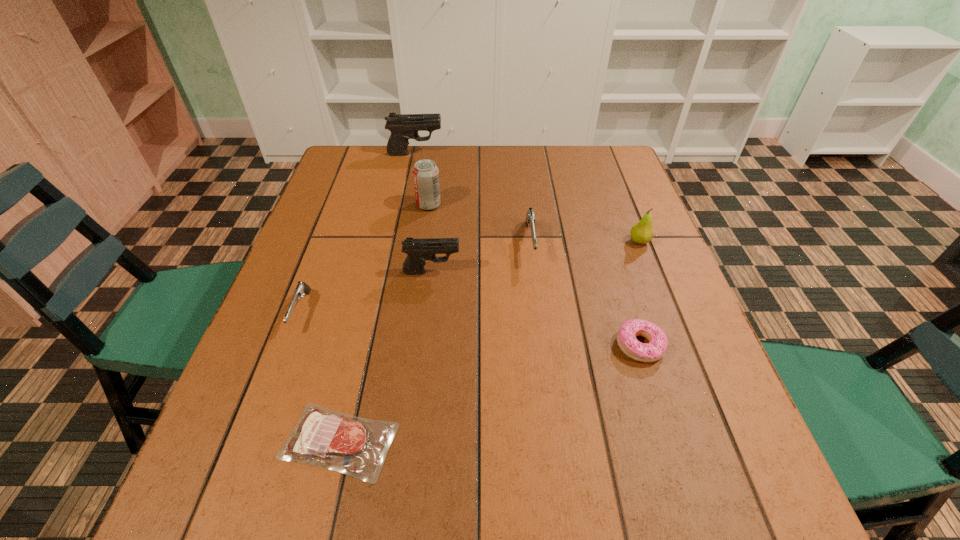
I want to click on free space located on the front-facing side of the left silver pistol, so click(281, 366).

This screenshot has width=960, height=540. What are the coordinates of `free location located on the back of the seventh object from left to right` in the screenshot? It's located at (599, 214).

At what (x,y) coordinates should I click in order to perform the action: click on vacant space situated on the back of the steak. Please return your answer as a coordinate pair (x, y). This screenshot has width=960, height=540. Looking at the image, I should click on (376, 281).

Identify the location of object present at the far edge. Image resolution: width=960 pixels, height=540 pixels. (403, 127).

This screenshot has width=960, height=540. Identify the location of object at the near edge. (355, 446).

Where is `steak positioned at the left edge`? steak positioned at the left edge is located at coordinates (355, 446).

The image size is (960, 540). What are the coordinates of `pear present at the right edge` in the screenshot? It's located at (642, 232).

This screenshot has width=960, height=540. I want to click on doughnut at the right edge, so click(x=626, y=337).

Identify the location of object present at the far left corner. Image resolution: width=960 pixels, height=540 pixels. (403, 127).

The image size is (960, 540). I want to click on object situated at the near left corner, so click(x=355, y=446).